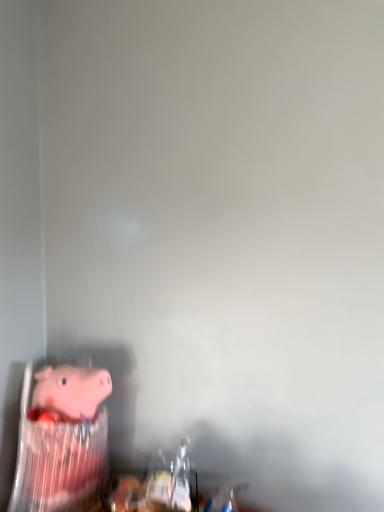
I want to click on pink plush toy at lower left, so click(x=59, y=460).

What do you see at coordinates (59, 460) in the screenshot? I see `pink plush toy at lower left` at bounding box center [59, 460].

The width and height of the screenshot is (384, 512). I want to click on pink plush toy at lower left, so click(x=59, y=460).